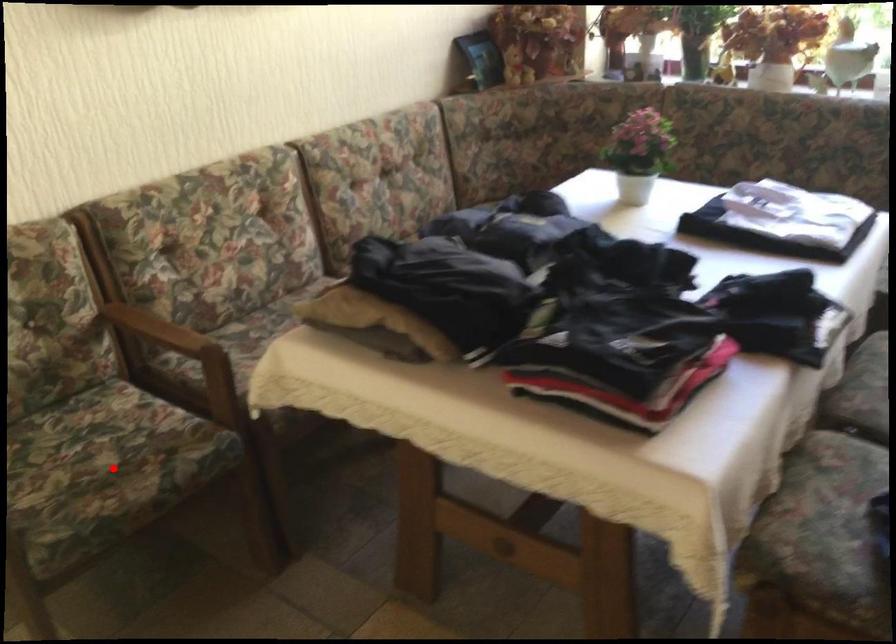
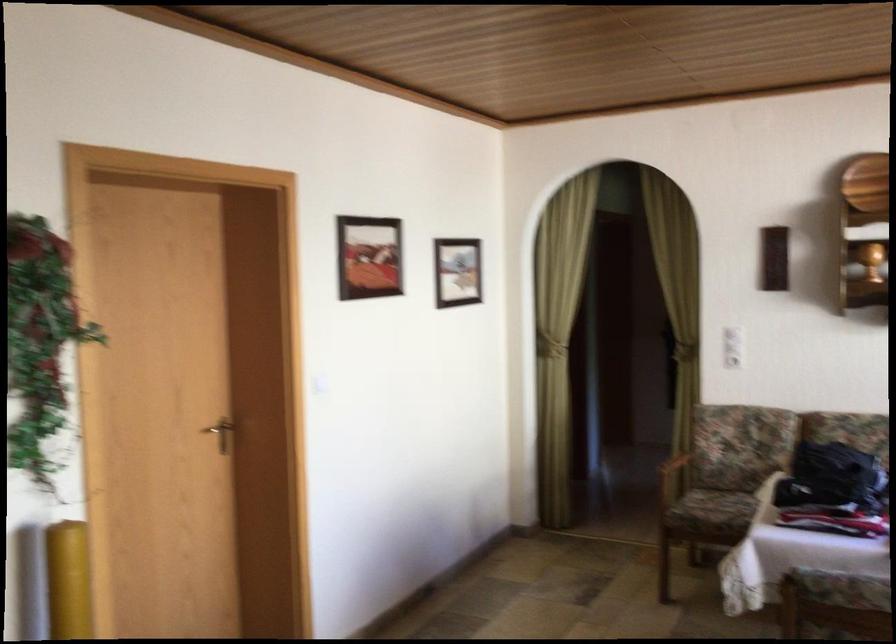
The point at the highlighted location is marked in the first image. Where is the corresponding point in the second image?

(725, 507)